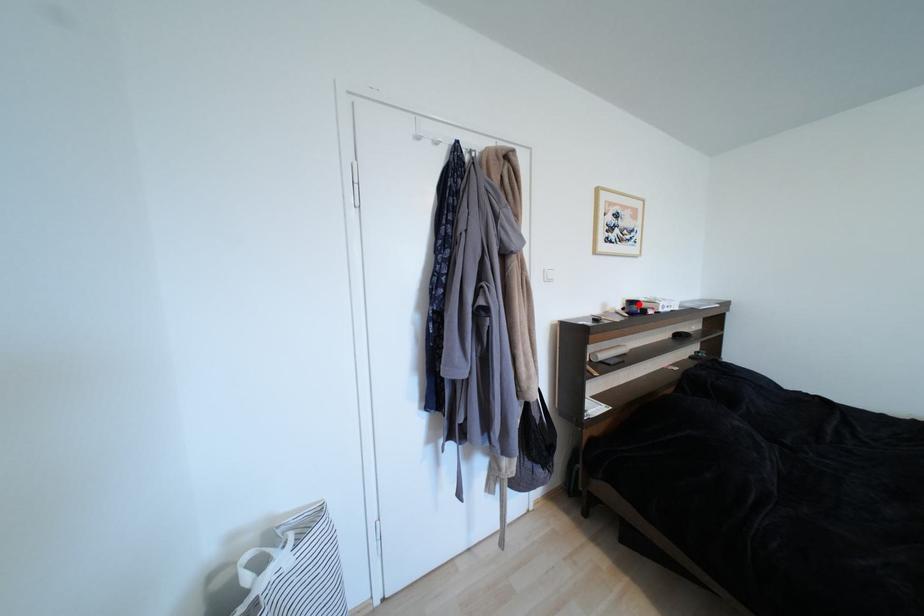
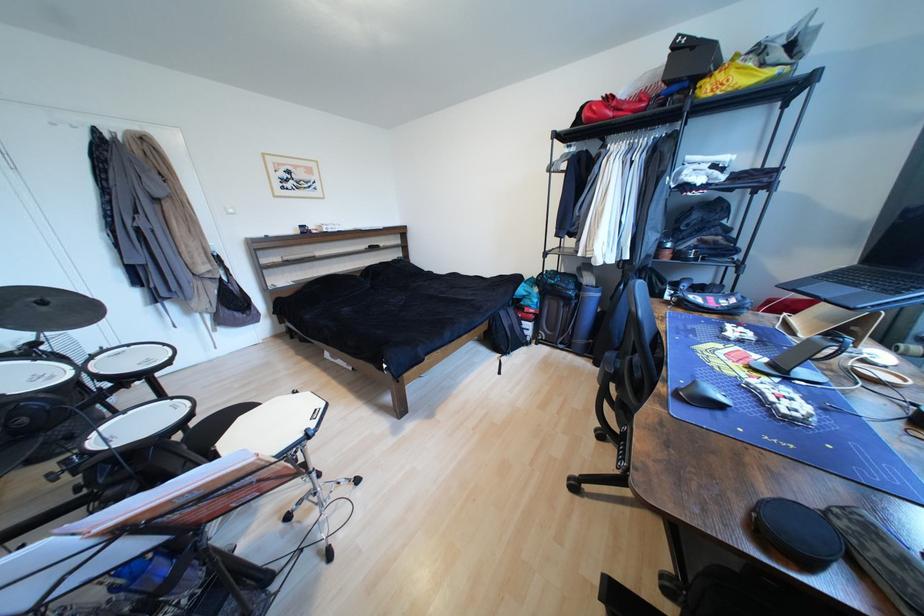
Locate, in the second image, the point that corresponds to the highlighted location in the first image.

(310, 228)